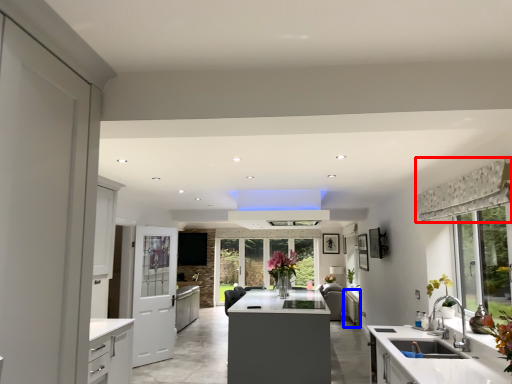
Question: Which object appears farthest to the camera in this image, curtain (highlighted by a red box) or cabinetry (highlighted by a blue box)?

Choices:
 (A) curtain
 (B) cabinetry

Answer: (B)